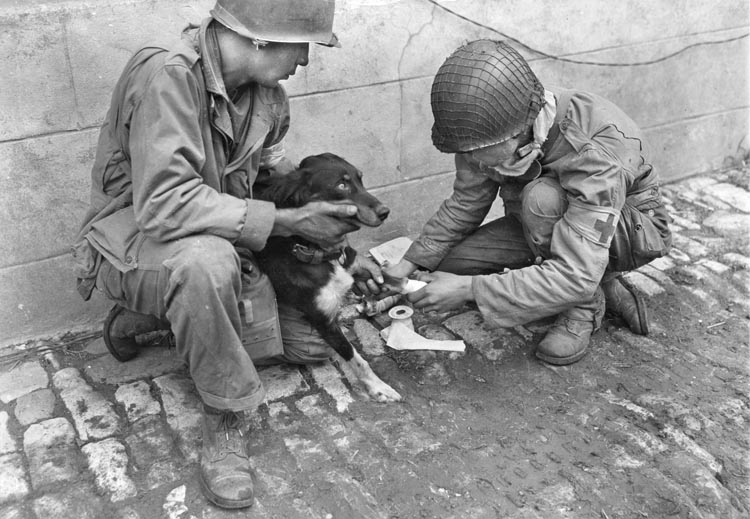
The width and height of the screenshot is (750, 519). Identify the location of concrete wall. (45, 40), (618, 31).